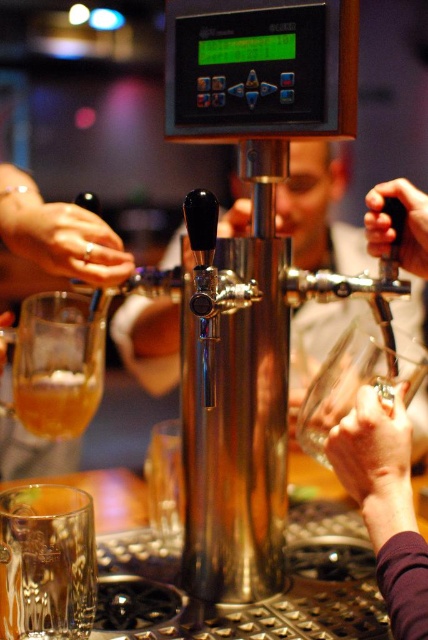
You are a bartender trying to pour a beer into a glass. There is a purple fabric hand at lower right at point (385, 502). Can you pour the beer without moving the purple fabric hand at lower right?

The purple fabric hand at lower right is located at point (385, 502), so yes, you can pour the beer without moving it since the hand is at that specific coordinate and not blocking the pouring area.